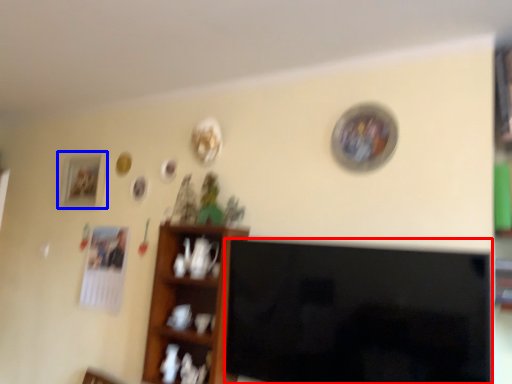
Question: Which object appears closest to the camera in this image, television (highlighted by a red box) or picture frame (highlighted by a blue box)?

Choices:
 (A) television
 (B) picture frame

Answer: (A)